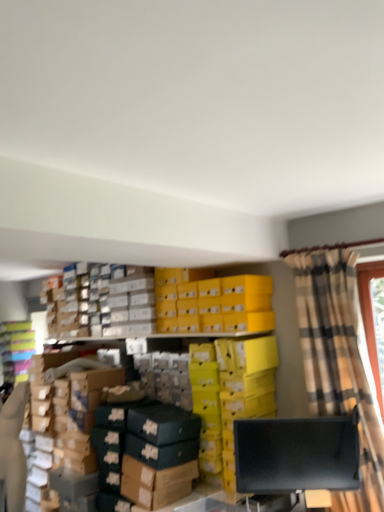
Question: Could black matte monitor at lower right be considered to be inside plaid fabric curtain at right?

Choices:
 (A) yes
 (B) no

Answer: (A)

Question: Is plaid fabric curtain at right further to the viewer compared to black matte monitor at lower right?

Choices:
 (A) no
 (B) yes

Answer: (A)

Question: From a real-world perspective, is plaid fabric curtain at right on black matte monitor at lower right?

Choices:
 (A) no
 (B) yes

Answer: (B)

Question: Is plaid fabric curtain at right to the right of black matte monitor at lower right from the viewer's perspective?

Choices:
 (A) yes
 (B) no

Answer: (A)

Question: Is plaid fabric curtain at right positioned with its back to black matte monitor at lower right?

Choices:
 (A) no
 (B) yes

Answer: (A)

Question: Can you confirm if plaid fabric curtain at right is shorter than black matte monitor at lower right?

Choices:
 (A) yes
 (B) no

Answer: (B)

Question: Is the position of matte plastic shoebox at left less distant than that of black matte monitor at lower right?

Choices:
 (A) yes
 (B) no

Answer: (B)

Question: From the image's perspective, is matte plastic shoebox at left over black matte monitor at lower right?

Choices:
 (A) yes
 (B) no

Answer: (A)

Question: Can black matte monitor at lower right be found inside matte plastic shoebox at left?

Choices:
 (A) yes
 (B) no

Answer: (B)

Question: Is matte plastic shoebox at left at the left side of black matte monitor at lower right?

Choices:
 (A) no
 (B) yes

Answer: (B)

Question: Is matte plastic shoebox at left facing away from black matte monitor at lower right?

Choices:
 (A) yes
 (B) no

Answer: (B)

Question: Considering the relative sizes of matte plastic shoebox at left and black matte monitor at lower right in the image provided, is matte plastic shoebox at left taller than black matte monitor at lower right?

Choices:
 (A) no
 (B) yes

Answer: (B)

Question: Can you confirm if black matte monitor at lower right is positioned to the right of matte plastic shoebox at left?

Choices:
 (A) no
 (B) yes

Answer: (B)